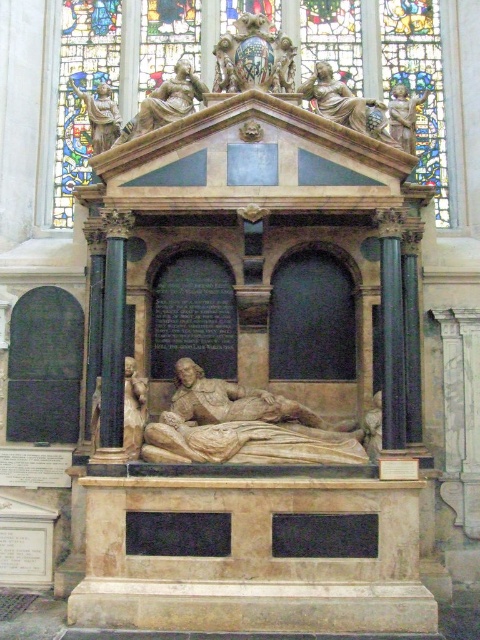
You are an art student analyzing the memorial monument. You notice the polished marble coat of arms at upper center and the matte stone statue at upper center. Which object is placed higher up on the monument?

The polished marble coat of arms at upper center is positioned over matte stone statue at upper center, so it is placed higher up.

You are an architect examining the memorial monument. You need to determine the relative positions of the black marble column at left and the polished marble statue at upper left. Which object is positioned to the right of the other?

The black marble column at left is to the right of polished marble statue at upper left, so the black marble column at left is positioned to the right of the polished marble statue at upper left.

You are standing in front of the memorial monument and want to take a photo that includes both the stained glass window at upper center and the black marble column at left. Which object should you position closer to the camera to ensure both are in focus?

You should position the black marble column at left closer to the camera since the stained glass window at upper center is further away, ensuring both are within the focal range.